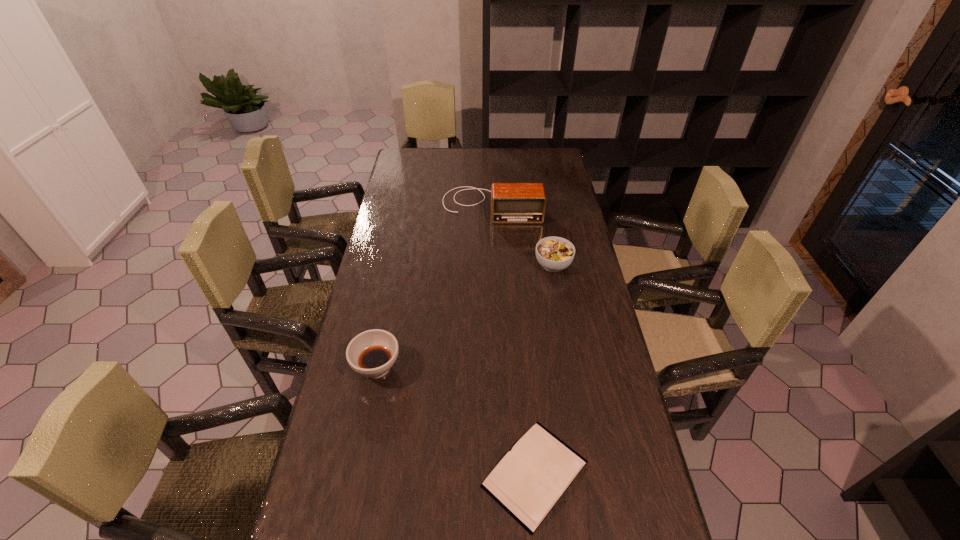
You are a GUI agent. You are given a task and a screenshot of the screen. Output one action in this format:
    pyautogui.click(x=<x>, y=<y>)
    Task: Click on the second closest object to the hardback book
    The width and height of the screenshot is (960, 540).
    Given the screenshot: What is the action you would take?
    pyautogui.click(x=553, y=253)

You are a GUI agent. You are given a task and a screenshot of the screen. Output one action in this format:
    pyautogui.click(x=<x>, y=<y>)
    Task: Click on the object that is the second closest to the right soup bowl
    The width and height of the screenshot is (960, 540).
    Given the screenshot: What is the action you would take?
    pyautogui.click(x=372, y=353)

The image size is (960, 540). I want to click on free space that satisfies the following two spatial constraints: 1. on the front-facing side of the third nearest object; 2. on the right side of the farthest object, so click(493, 265).

Image resolution: width=960 pixels, height=540 pixels. Find the location of `vacant space that satisfies the following two spatial constraints: 1. on the front-facing side of the tallest object; 2. on the right side of the farther soup bowl`. vacant space that satisfies the following two spatial constraints: 1. on the front-facing side of the tallest object; 2. on the right side of the farther soup bowl is located at coordinates (493, 265).

The height and width of the screenshot is (540, 960). I want to click on free space that satisfies the following two spatial constraints: 1. on the front-facing side of the right soup bowl; 2. on the left side of the farthest object, so click(493, 265).

Where is `vacant region that satisfies the following two spatial constraints: 1. on the front-facing side of the right soup bowl; 2. on the left side of the radio receiver`? The height and width of the screenshot is (540, 960). vacant region that satisfies the following two spatial constraints: 1. on the front-facing side of the right soup bowl; 2. on the left side of the radio receiver is located at coordinates (493, 265).

This screenshot has height=540, width=960. Find the location of `free space that satisfies the following two spatial constraints: 1. on the front-facing side of the farthest object; 2. on the right side of the third nearest object`. free space that satisfies the following two spatial constraints: 1. on the front-facing side of the farthest object; 2. on the right side of the third nearest object is located at coordinates (493, 265).

The height and width of the screenshot is (540, 960). In order to click on free space that satisfies the following two spatial constraints: 1. on the front-facing side of the hardback book; 2. on the right side of the radio receiver in this screenshot , I will do `click(499, 474)`.